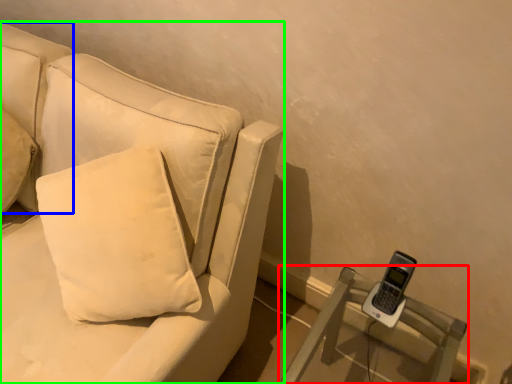
Question: Which object is positioned closest to furniture (highlighted by a red box)? Select from pillow (highlighted by a blue box) and studio couch (highlighted by a green box).

Choices:
 (A) pillow
 (B) studio couch

Answer: (B)